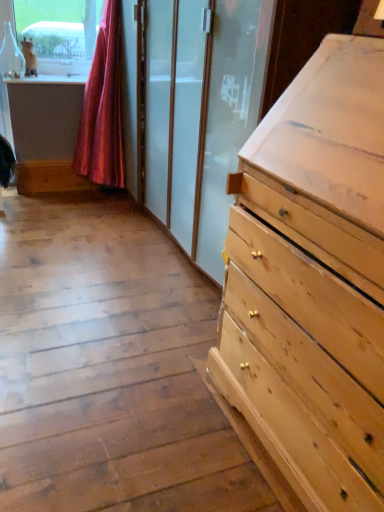
Question: Can you confirm if silky pink curtain at upper left is taller than white fur cat at upper left?

Choices:
 (A) yes
 (B) no

Answer: (A)

Question: Considering the relative positions of silky pink curtain at upper left and white fur cat at upper left in the image provided, is silky pink curtain at upper left to the left of white fur cat at upper left from the viewer's perspective?

Choices:
 (A) yes
 (B) no

Answer: (B)

Question: Would you say silky pink curtain at upper left contains white fur cat at upper left?

Choices:
 (A) yes
 (B) no

Answer: (B)

Question: Does silky pink curtain at upper left have a smaller size compared to white fur cat at upper left?

Choices:
 (A) yes
 (B) no

Answer: (B)

Question: Is silky pink curtain at upper left thinner than white fur cat at upper left?

Choices:
 (A) yes
 (B) no

Answer: (B)

Question: Is silky pink curtain at upper left not within white fur cat at upper left?

Choices:
 (A) no
 (B) yes

Answer: (B)

Question: Considering the relative sizes of white fur cat at upper left and silky pink curtain at upper left in the image provided, is white fur cat at upper left taller than silky pink curtain at upper left?

Choices:
 (A) no
 (B) yes

Answer: (A)

Question: From a real-world perspective, is white fur cat at upper left located beneath silky pink curtain at upper left?

Choices:
 (A) yes
 (B) no

Answer: (B)

Question: Is white fur cat at upper left to the right of silky pink curtain at upper left from the viewer's perspective?

Choices:
 (A) yes
 (B) no

Answer: (B)

Question: Is white fur cat at upper left aimed at silky pink curtain at upper left?

Choices:
 (A) yes
 (B) no

Answer: (B)

Question: Is the depth of white fur cat at upper left greater than that of silky pink curtain at upper left?

Choices:
 (A) yes
 (B) no

Answer: (A)

Question: Is white fur cat at upper left wider than silky pink curtain at upper left?

Choices:
 (A) no
 (B) yes

Answer: (A)

Question: Looking at the image, does white fur cat at upper left seem bigger or smaller compared to silky pink curtain at upper left?

Choices:
 (A) small
 (B) big

Answer: (A)